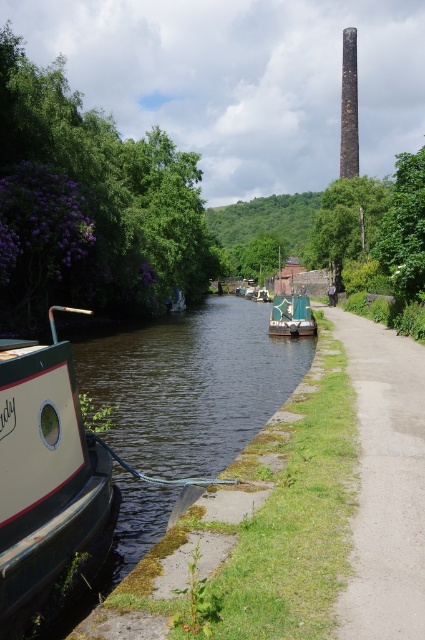
Who is more forward, (x=184, y=292) or (x=297, y=305)?

Point (x=297, y=305)

Who is positioned more to the left, purple leafy tree at upper left or green canvas boat at center?

Positioned to the left is purple leafy tree at upper left.

Who is more forward, (5, 275) or (288, 330)?

Point (5, 275)

Identify the location of purple leafy tree at upper left. The image size is (425, 640). (90, 202).

Does white glossy boat at left appear under green grass at lower left?

No, white glossy boat at left is not below green grass at lower left.

Does white glossy boat at left appear over green grass at lower left?

Yes, white glossy boat at left is above green grass at lower left.

The width and height of the screenshot is (425, 640). Describe the element at coordinates (48, 484) in the screenshot. I see `white glossy boat at left` at that location.

Where is `white glossy boat at left`? The width and height of the screenshot is (425, 640). white glossy boat at left is located at coordinates (48, 484).

Is white glossy boat at left further to camera compared to green leafy tree at upper right?

That is False.

Is white glossy boat at left smaller than green leafy tree at upper right?

Indeed, white glossy boat at left has a smaller size compared to green leafy tree at upper right.

Does point (71, 467) come closer to viewer compared to point (401, 211)?

Yes, point (71, 467) is in front of point (401, 211).

Image resolution: width=425 pixels, height=640 pixels. I want to click on white glossy boat at left, so click(x=48, y=484).